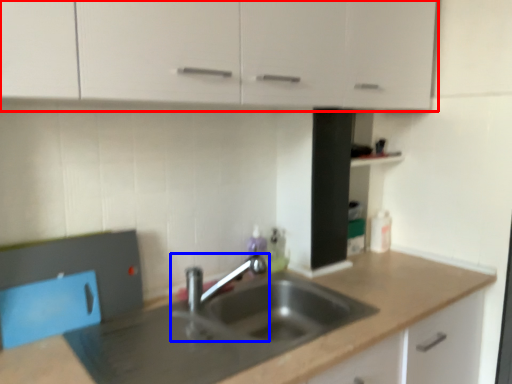
Question: Which of the following is the farthest to the observer, cabinetry (highlighted by a red box) or tap (highlighted by a blue box)?

Choices:
 (A) cabinetry
 (B) tap

Answer: (B)